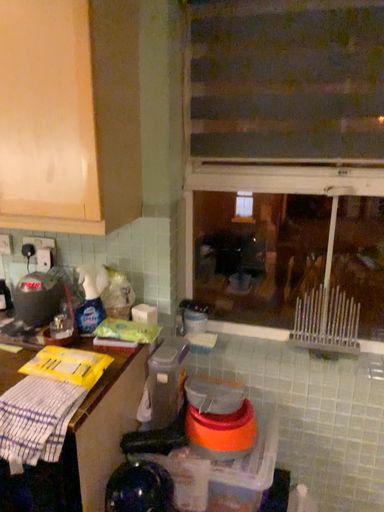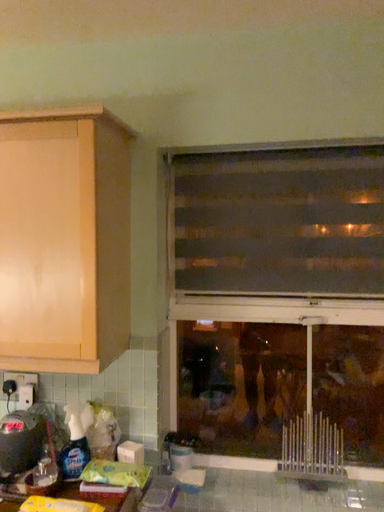
Question: Which way did the camera rotate in the video?

Choices:
 (A) rotated downward
 (B) rotated upward

Answer: (B)